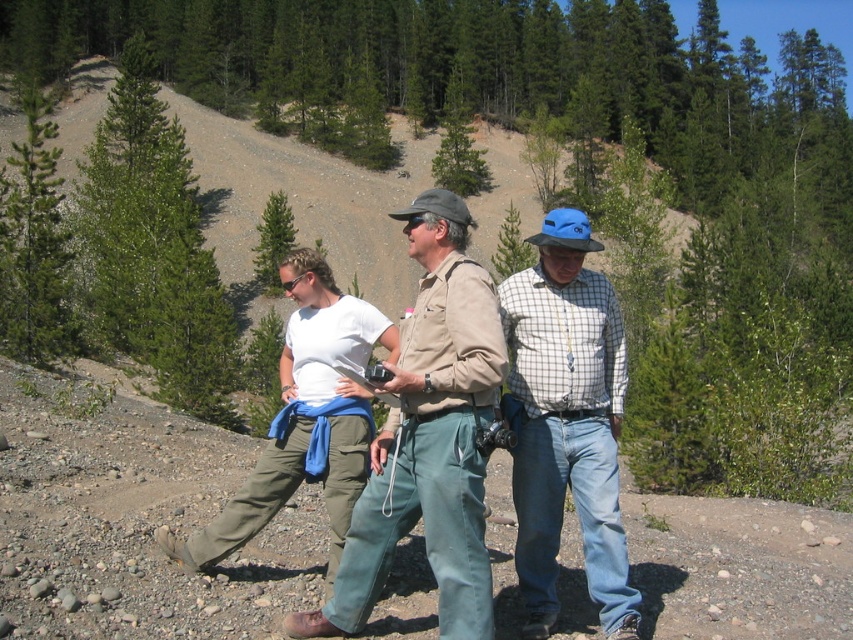
Question: Estimate the real-world distances between objects in this image. Which object is closer to the white cotton shirt at center?

Choices:
 (A) checkered fabric shirt at center
 (B) khaki cotton shirt at center

Answer: (A)

Question: Considering the relative positions of khaki cotton shirt at center and checkered fabric shirt at center in the image provided, where is khaki cotton shirt at center located with respect to checkered fabric shirt at center?

Choices:
 (A) below
 (B) above

Answer: (B)

Question: Which point is farther from the camera taking this photo?

Choices:
 (A) (512, 480)
 (B) (409, 358)
 (C) (369, 608)
 (D) (341, 416)

Answer: (D)

Question: Which of these objects is positioned farthest from the khaki cotton shirt at center?

Choices:
 (A) khaki cotton pants at center
 (B) checkered fabric shirt at center
 (C) white cotton shirt at center

Answer: (C)

Question: Is checkered fabric shirt at center further to the viewer compared to white cotton shirt at center?

Choices:
 (A) yes
 (B) no

Answer: (B)

Question: Is khaki cotton shirt at center wider than white cotton shirt at center?

Choices:
 (A) yes
 (B) no

Answer: (B)